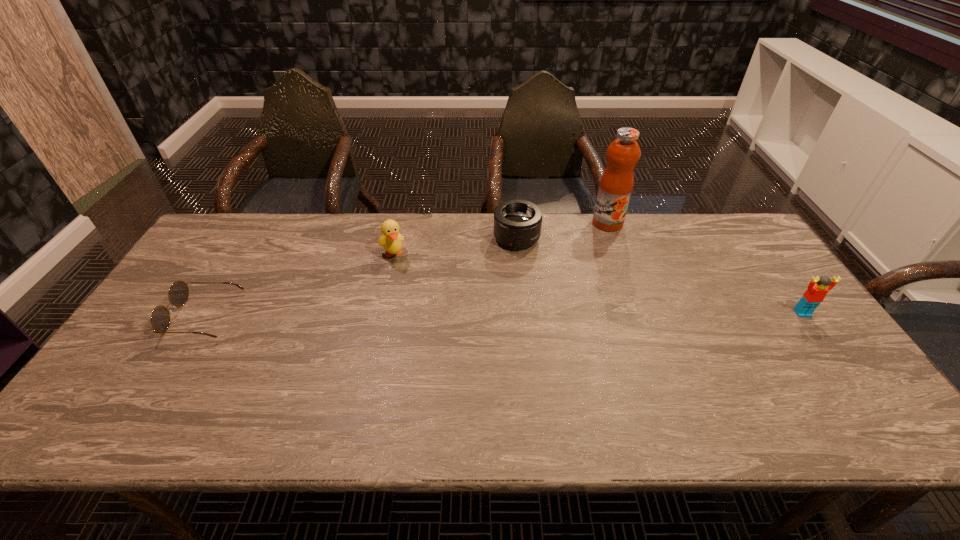
This screenshot has width=960, height=540. What are the coordinates of `vacant area that lies between the rightmost object and the second shortest object` in the screenshot? It's located at (660, 275).

The image size is (960, 540). I want to click on free space between the third object from left to right and the Lego, so click(x=660, y=275).

What are the coordinates of `free spot between the duckling and the Lego` in the screenshot? It's located at (597, 284).

Where is `vacant region between the Lego and the shortest object`? vacant region between the Lego and the shortest object is located at coordinates (503, 314).

You are a GUI agent. You are given a task and a screenshot of the screen. Output one action in this format:
    pyautogui.click(x=<x>, y=<y>)
    Task: Click on the free area in between the Lego and the fruit juice
    Image resolution: width=960 pixels, height=540 pixels.
    Given the screenshot: What is the action you would take?
    pyautogui.click(x=705, y=268)

The height and width of the screenshot is (540, 960). I want to click on vacant space that is in between the third object from right to left and the duckling, so pos(454,246).

Identify the location of empty space between the third object from left to right and the rightmost object. Image resolution: width=960 pixels, height=540 pixels. (660, 275).

Where is `free space between the fourth object from left to right and the sunglasses`? The height and width of the screenshot is (540, 960). free space between the fourth object from left to right and the sunglasses is located at coordinates (406, 269).

I want to click on the second closest object to the rightmost object, so point(517,223).

Locate an element on the screen. This screenshot has width=960, height=540. object that is the second nearest to the duckling is located at coordinates (178, 294).